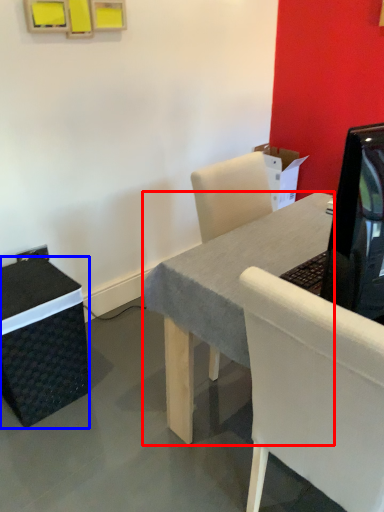
Question: Among these objects, which one is nearest to the camera, desk (highlighted by a red box) or box (highlighted by a blue box)?

Choices:
 (A) desk
 (B) box

Answer: (A)